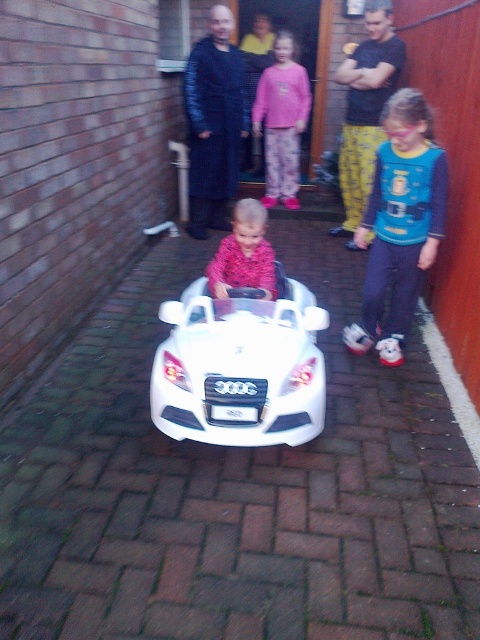
Does white plastic car at center have a larger size compared to pink fleece sweater at center?

Actually, white plastic car at center might be smaller than pink fleece sweater at center.

Is white plastic car at center shorter than pink fleece sweater at center?

Yes.

This screenshot has width=480, height=640. What do you see at coordinates (240, 368) in the screenshot? I see `white plastic car at center` at bounding box center [240, 368].

The height and width of the screenshot is (640, 480). Identify the location of white plastic car at center. (240, 368).

Between pink fleece sweater at center and pink fuzzy sweater at center, which one is positioned higher?

Positioned higher is pink fleece sweater at center.

Is pink fleece sweater at center further to camera compared to pink fuzzy sweater at center?

Yes, pink fleece sweater at center is further from the viewer.

Is point (279, 144) less distant than point (260, 211)?

No, it is behind (260, 211).

What are the coordinates of `pink fleece sweater at center` in the screenshot? It's located at (282, 122).

Can you confirm if white plastic car at center is thinner than pink fuzzy sweater at center?

No, white plastic car at center is not thinner than pink fuzzy sweater at center.

Is white plastic car at center to the right of pink fuzzy sweater at center from the viewer's perspective?

Correct, you'll find white plastic car at center to the right of pink fuzzy sweater at center.

Is point (194, 284) positioned behind point (228, 264)?

Yes, point (194, 284) is behind point (228, 264).

Find the location of `white plastic car at center`. white plastic car at center is located at coordinates (240, 368).